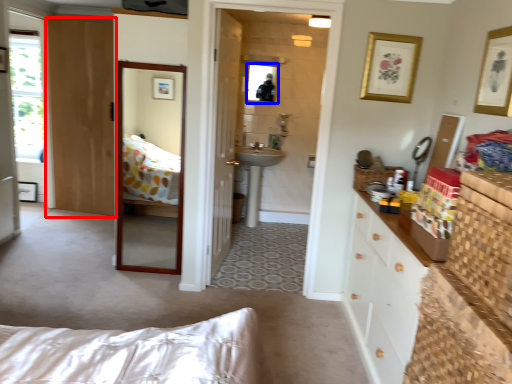
Question: Which of the following is the farthest to the observer, door (highlighted by a red box) or mirror (highlighted by a blue box)?

Choices:
 (A) door
 (B) mirror

Answer: (B)